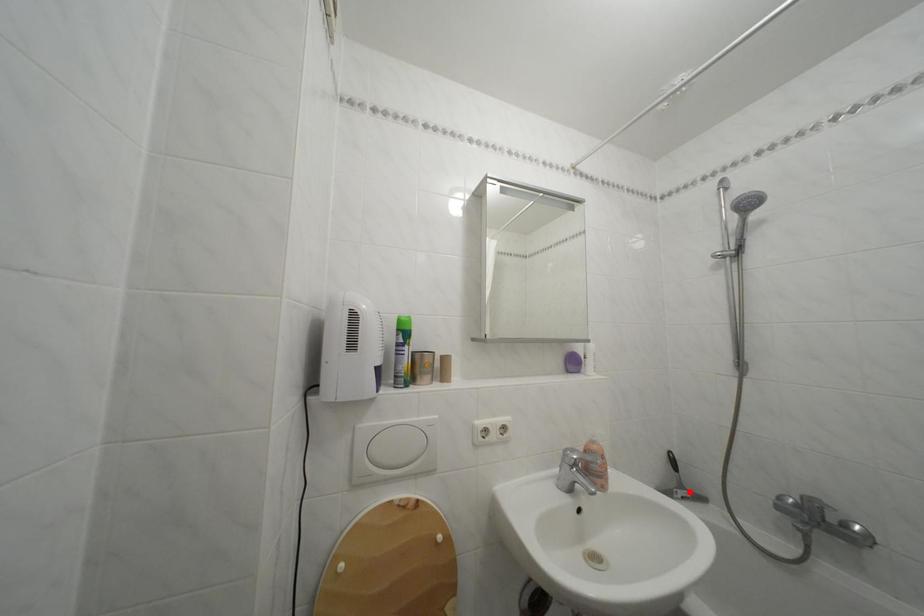
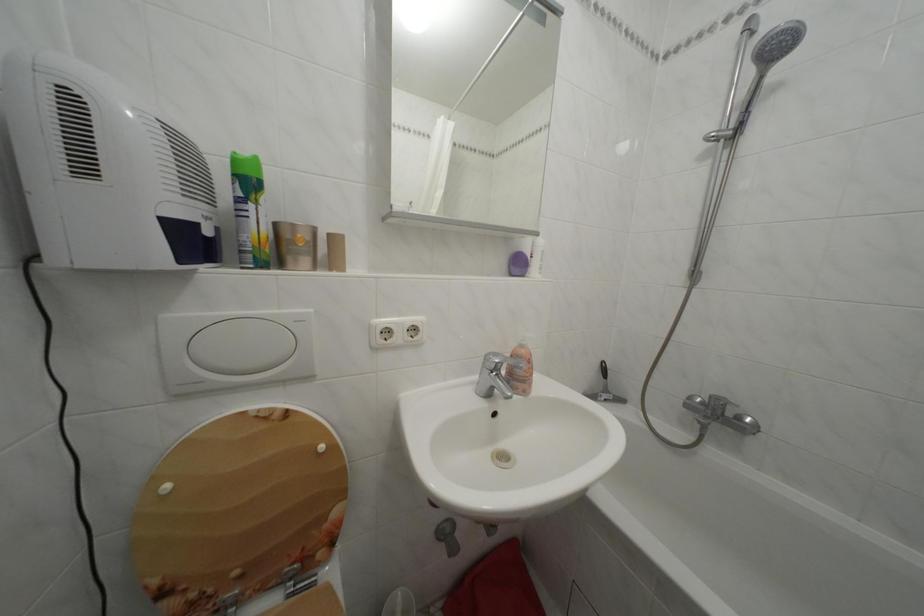
Question: I am providing you with two images of the same scene from different viewpoints. In image1, a red point is highlighted. Considering the same 3D point in image2, which of the following is correct?

Choices:
 (A) It is closer
 (B) It is farther

Answer: (B)